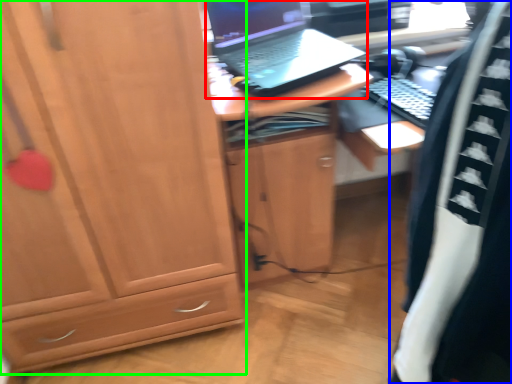
Question: Based on their relative distances, which object is nearer to laptop (highlighted by a red box)? Choose from clothing (highlighted by a blue box) and cabinetry (highlighted by a green box).

Choices:
 (A) clothing
 (B) cabinetry

Answer: (B)